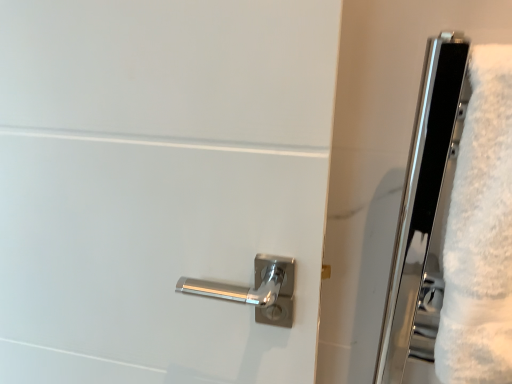
Question: From the image's perspective, is polished metal handle at center above or below white fluffy bath towel at right?

Choices:
 (A) below
 (B) above

Answer: (A)

Question: From a real-world perspective, is polished metal handle at center physically located above or below white fluffy bath towel at right?

Choices:
 (A) above
 (B) below

Answer: (B)

Question: In the image, is polished metal handle at center positioned in front of or behind white fluffy bath towel at right?

Choices:
 (A) front
 (B) behind

Answer: (B)

Question: In the image, is white fluffy bath towel at right positioned in front of or behind polished metal handle at center?

Choices:
 (A) behind
 (B) front

Answer: (B)

Question: From the image's perspective, is white fluffy bath towel at right above or below polished metal handle at center?

Choices:
 (A) above
 (B) below

Answer: (A)

Question: Which is correct: white fluffy bath towel at right is inside polished metal handle at center, or outside of it?

Choices:
 (A) outside
 (B) inside

Answer: (A)

Question: Is white fluffy bath towel at right to the left or to the right of polished metal handle at center in the image?

Choices:
 (A) right
 (B) left

Answer: (A)